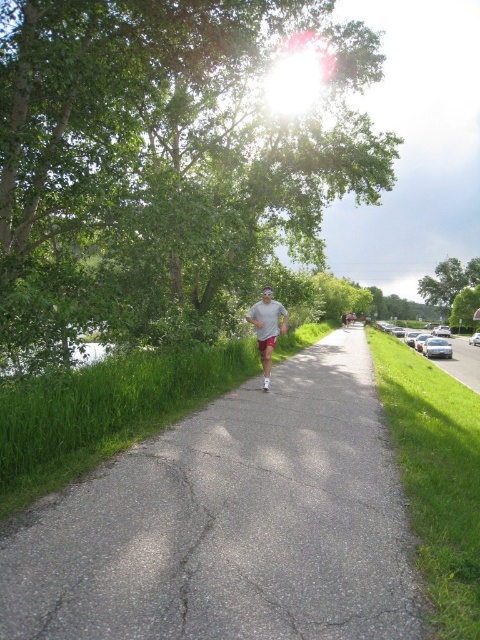
Question: Is gray asphalt path at center below gray cotton shirt at center?

Choices:
 (A) no
 (B) yes

Answer: (B)

Question: Which point appears farthest from the camera in this image?

Choices:
 (A) (432, 291)
 (B) (169, 449)

Answer: (A)

Question: Does green leafy tree at center have a lesser width compared to green leafy tree at right?

Choices:
 (A) no
 (B) yes

Answer: (A)

Question: In this image, where is green leafy tree at center located relative to gray cotton shirt at center?

Choices:
 (A) right
 (B) left

Answer: (B)

Question: Based on their relative distances, which object is farther from the gray cotton shirt at center?

Choices:
 (A) gray asphalt path at center
 (B) green leafy tree at center
 (C) green leafy tree at right

Answer: (C)

Question: Which point appears closest to the camera in this image?

Choices:
 (A) (430, 285)
 (B) (95, 321)
 (C) (300, 528)

Answer: (C)